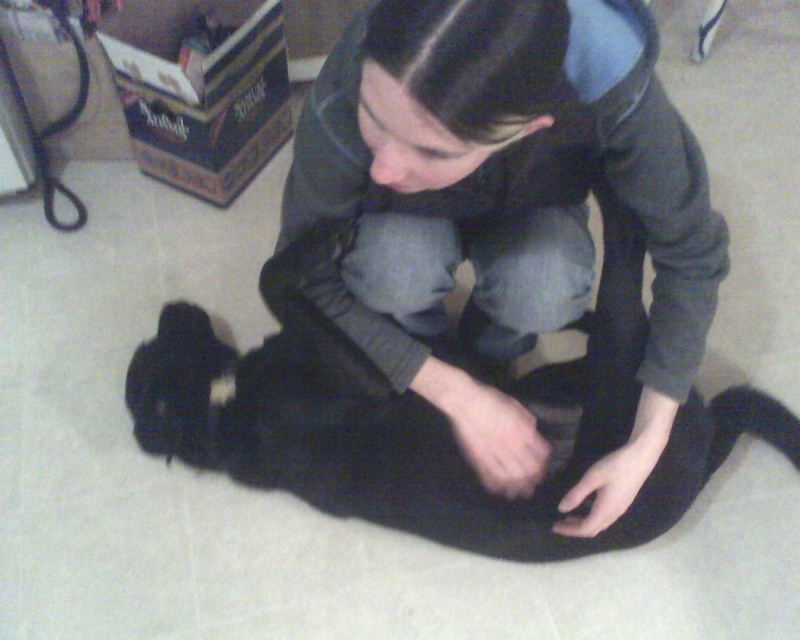
You are a delivery person who needs to place a large package between the dark gray hoodie at center and the black fur cat at center. Is there enough space to fit the package?

The distance between the dark gray hoodie at center and the black fur cat at center is 9.39 inches. Since the package is large, it likely requires more space than the available 9.39 inches, so it won

You are a delivery person who needs to leave a package at the exact location of the dark gray hoodie at center. What coordinates should you use for the delivery?

The dark gray hoodie at center is located at coordinates (504, 193), so you should deliver the package to those coordinates.